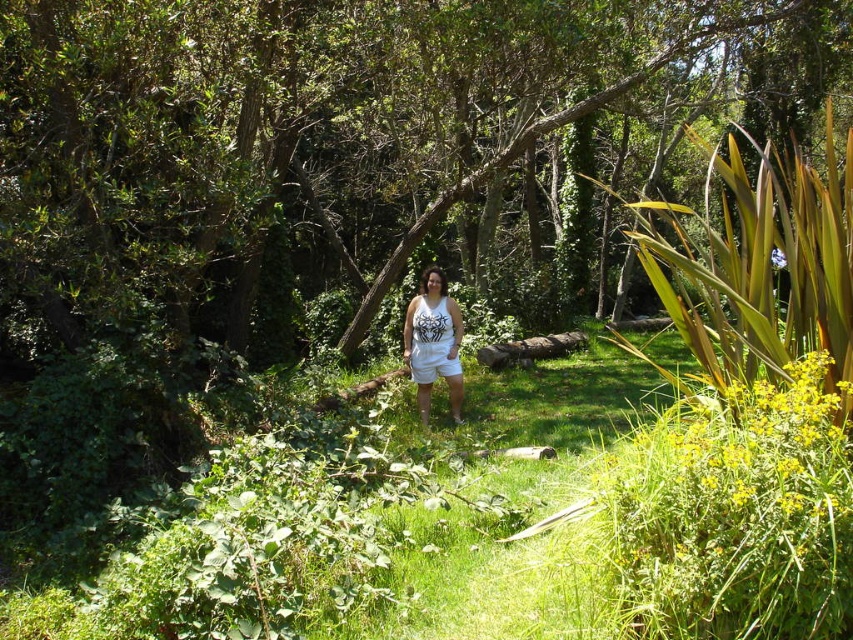
You are a photographer planning to capture a closeup of the green grass at center and the white cotton tank top at center. Which object takes up more area in the photo?

The white cotton tank top at center occupies more space than the green grass at center in the photo.

You are a photographer trying to capture a detailed shot of the green grass at center and the white cotton tank top at center. Which object should you focus on first if you want to ensure both are in focus without adjusting the camera settings?

You should focus on the green grass at center first because it is closer to the viewer than the white cotton tank top at center, so focusing on the closer object will keep both in focus when using a small aperture.